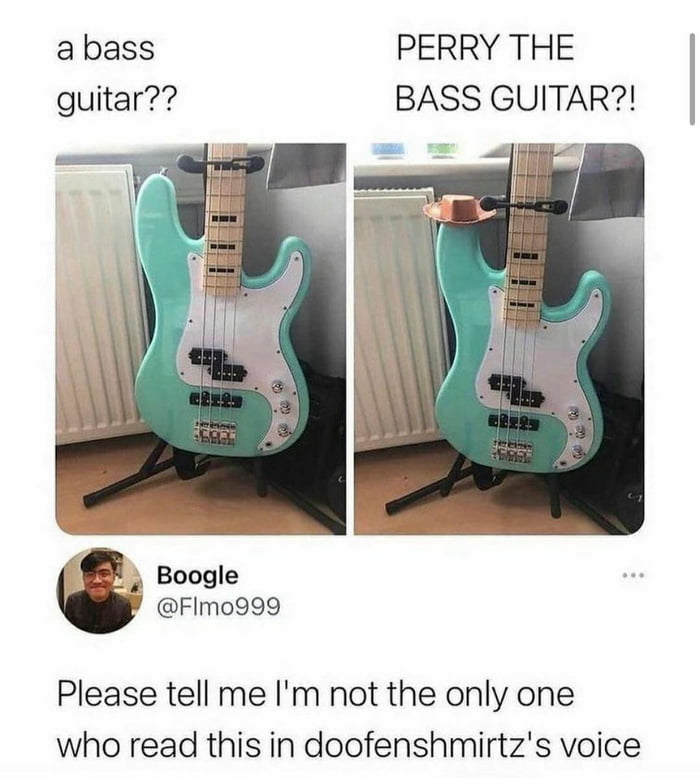
Image resolution: width=700 pixels, height=778 pixels. I want to click on picture, so click(x=172, y=498).